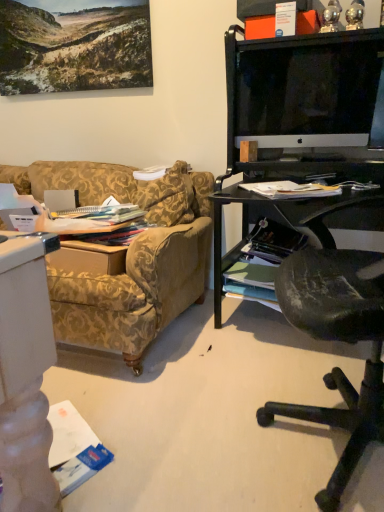
The image size is (384, 512). I want to click on shiny metallic magazine at lower right, which is the second magazine from top to bottom, so click(273, 241).

Image resolution: width=384 pixels, height=512 pixels. Identify the location of white paper magazine at right, marked as the first magazine in a top-to-bottom arrangement. (291, 189).

Considering the sizes of objects white paper magazine at right, arranged as the 2th magazine when ordered from the bottom, and white glossy monitor at upper right in the image provided, who is taller, white paper magazine at right, arranged as the 2th magazine when ordered from the bottom, or white glossy monitor at upper right?

Standing taller between the two is white glossy monitor at upper right.

Is white paper magazine at right, the first magazine when ordered from front to back, in contact with white glossy monitor at upper right?

No, white paper magazine at right, the first magazine when ordered from front to back, is not in contact with white glossy monitor at upper right.

From the image's perspective, which object appears higher, white paper magazine at right, marked as the first magazine in a top-to-bottom arrangement, or white glossy monitor at upper right?

From the image's view, white glossy monitor at upper right is above.

Is white glossy monitor at upper right positioned beyond the bounds of white paper magazine at right, marked as the first magazine in a top-to-bottom arrangement?

Absolutely, white glossy monitor at upper right is external to white paper magazine at right, marked as the first magazine in a top-to-bottom arrangement.

Between white glossy monitor at upper right and white paper magazine at right, placed as the second magazine when sorted from back to front, which one has smaller width?

white glossy monitor at upper right.

Is point (260, 116) more distant than point (284, 189)?

Yes, it is behind point (284, 189).

From a real-world perspective, between white glossy monitor at upper right and white paper magazine at right, the first magazine when ordered from front to back, who is vertically lower?

From a 3D spatial view, white paper magazine at right, the first magazine when ordered from front to back, is below.

What's the angular difference between white paper magazine at right, placed as the second magazine when sorted from back to front, and shiny metallic magazine at lower right, which is the second magazine from top to bottom,'s facing directions?

34.1 degrees separate the facing orientations of white paper magazine at right, placed as the second magazine when sorted from back to front, and shiny metallic magazine at lower right, which is the second magazine from top to bottom.

Is white paper magazine at right, the first magazine when ordered from front to back, wider or thinner than shiny metallic magazine at lower right, which is counted as the 1th magazine, starting from the back?

Clearly, white paper magazine at right, the first magazine when ordered from front to back, has less width compared to shiny metallic magazine at lower right, which is counted as the 1th magazine, starting from the back.

Is white paper magazine at right, the first magazine when ordered from front to back, facing towards shiny metallic magazine at lower right, arranged as the first magazine when ordered from the bottom?

No, white paper magazine at right, the first magazine when ordered from front to back, is not turned towards shiny metallic magazine at lower right, arranged as the first magazine when ordered from the bottom.

Which of these two, shiny metallic magazine at lower right, which is the second magazine from top to bottom, or white paper magazine at right, marked as the first magazine in a top-to-bottom arrangement, stands shorter?

white paper magazine at right, marked as the first magazine in a top-to-bottom arrangement.

Can you confirm if shiny metallic magazine at lower right, which is counted as the 1th magazine, starting from the back, is smaller than white paper magazine at right, the first magazine when ordered from front to back?

Actually, shiny metallic magazine at lower right, which is counted as the 1th magazine, starting from the back, might be larger than white paper magazine at right, the first magazine when ordered from front to back.

Is shiny metallic magazine at lower right, which is counted as the 1th magazine, starting from the back, positioned behind white paper magazine at right, the first magazine when ordered from front to back?

That is True.

Does white glossy monitor at upper right turn towards shiny metallic magazine at lower right, which is counted as the 1th magazine, starting from the back?

No, white glossy monitor at upper right is not facing towards shiny metallic magazine at lower right, which is counted as the 1th magazine, starting from the back.

How different are the orientations of white glossy monitor at upper right and shiny metallic magazine at lower right, arranged as the first magazine when ordered from the bottom, in degrees?

The facing directions of white glossy monitor at upper right and shiny metallic magazine at lower right, arranged as the first magazine when ordered from the bottom, are 13.9 degrees apart.

Is white glossy monitor at upper right wider or thinner than shiny metallic magazine at lower right, which is counted as the 1th magazine, starting from the back?

white glossy monitor at upper right is thinner than shiny metallic magazine at lower right, which is counted as the 1th magazine, starting from the back.

Is point (273, 144) closer or farther from the camera than point (300, 234)?

Point (273, 144) is positioned closer to the camera compared to point (300, 234).

From a real-world perspective, between shiny metallic magazine at lower right, arranged as the 2th magazine when viewed from the front, and white glossy monitor at upper right, who is vertically lower?

shiny metallic magazine at lower right, arranged as the 2th magazine when viewed from the front, from a real-world perspective.

Which of these two, shiny metallic magazine at lower right, which is the second magazine from top to bottom, or white glossy monitor at upper right, stands shorter?

With less height is shiny metallic magazine at lower right, which is the second magazine from top to bottom.

Considering the relative sizes of shiny metallic magazine at lower right, arranged as the first magazine when ordered from the bottom, and white glossy monitor at upper right in the image provided, is shiny metallic magazine at lower right, arranged as the first magazine when ordered from the bottom, smaller than white glossy monitor at upper right?

A: Correct, shiny metallic magazine at lower right, arranged as the first magazine when ordered from the bottom, occupies less space than white glossy monitor at upper right.

Is shiny metallic magazine at lower right, which is counted as the 1th magazine, starting from the back, looking in the opposite direction of white glossy monitor at upper right?

No, shiny metallic magazine at lower right, which is counted as the 1th magazine, starting from the back,'s orientation is not away from white glossy monitor at upper right.

I want to click on television above the white paper magazine at right, placed as the second magazine when sorted from back to front (from a real-world perspective), so click(x=304, y=89).

In order to click on television on the right side of white paper magazine at right, placed as the second magazine when sorted from back to front in this screenshot , I will do `click(304, 89)`.

Considering their positions, is shiny metallic magazine at lower right, which is the second magazine from top to bottom, positioned closer to white paper magazine at right, marked as the first magazine in a top-to-bottom arrangement, than white glossy monitor at upper right?

shiny metallic magazine at lower right, which is the second magazine from top to bottom, is positioned closer to the anchor white paper magazine at right, marked as the first magazine in a top-to-bottom arrangement.

Looking at the image, which one is located further to white paper magazine at right, marked as the first magazine in a top-to-bottom arrangement, white glossy monitor at upper right or shiny metallic magazine at lower right, arranged as the 2th magazine when viewed from the front?

Based on the image, white glossy monitor at upper right appears to be further to white paper magazine at right, marked as the first magazine in a top-to-bottom arrangement.

Looking at this image, when comparing their distances from shiny metallic magazine at lower right, which is the second magazine from top to bottom, does white glossy monitor at upper right or white paper magazine at right, placed as the second magazine when sorted from back to front, seem closer?

white paper magazine at right, placed as the second magazine when sorted from back to front.

Based on their spatial positions, is white paper magazine at right, marked as the first magazine in a top-to-bottom arrangement, or white glossy monitor at upper right closer to shiny metallic magazine at lower right, which is counted as the 1th magazine, starting from the back?

white paper magazine at right, marked as the first magazine in a top-to-bottom arrangement.

Based on their spatial positions, is white paper magazine at right, marked as the first magazine in a top-to-bottom arrangement, or shiny metallic magazine at lower right, which is counted as the 1th magazine, starting from the back, further from white glossy monitor at upper right?

shiny metallic magazine at lower right, which is counted as the 1th magazine, starting from the back.

In the scene shown: From the image, which object appears to be farther from white glossy monitor at upper right, shiny metallic magazine at lower right, arranged as the first magazine when ordered from the bottom, or white paper magazine at right, arranged as the 2th magazine when ordered from the bottom?

shiny metallic magazine at lower right, arranged as the first magazine when ordered from the bottom.

Identify the location of magazine between white glossy monitor at upper right and shiny metallic magazine at lower right, arranged as the first magazine when ordered from the bottom, from top to bottom. Image resolution: width=384 pixels, height=512 pixels. (291, 189).